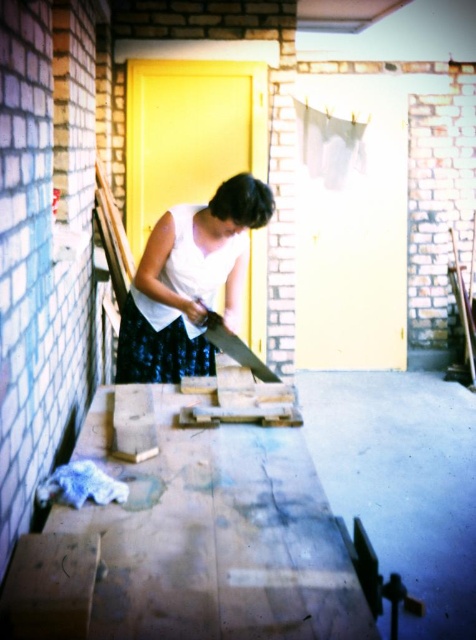
Question: Among these points, which one is farthest from the camera?

Choices:
 (A) (170, 438)
 (B) (135, 358)
 (C) (209, 340)

Answer: (B)

Question: Which point is farther from the camera taking this photo?

Choices:
 (A) (208, 268)
 (B) (240, 362)

Answer: (A)

Question: Which object appears closest to the camera in this image?

Choices:
 (A) metallic saw at center
 (B) smooth wooden plank at lower center
 (C) white matte dress at center

Answer: (B)

Question: Does white matte dress at center have a lesser width compared to metallic saw at center?

Choices:
 (A) no
 (B) yes

Answer: (A)

Question: Can you confirm if smooth wooden plank at lower center is smaller than metallic saw at center?

Choices:
 (A) yes
 (B) no

Answer: (B)

Question: Is smooth wooden plank at lower center positioned behind white matte dress at center?

Choices:
 (A) yes
 (B) no

Answer: (B)